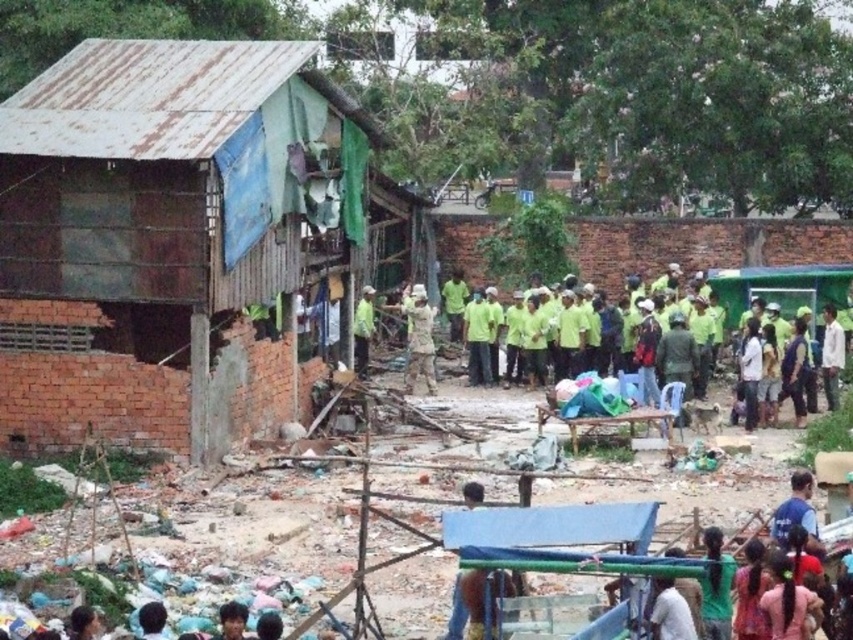
Question: Estimate the real-world distances between objects in this image. Which object is farther from the smooth brown hair at lower center?

Choices:
 (A) dark brown hair at lower left
 (B) green matte shirt at center
 (C) camouflage fabric uniform at center
 (D) rusty metal hut at left

Answer: (B)

Question: Where is camouflage fabric uniform at center located in relation to dark brown hair at lower left in the image?

Choices:
 (A) right
 (B) left

Answer: (A)

Question: Which of the following is the farthest from the observer?

Choices:
 (A) camouflage fabric uniform at center
 (B) green matte shirt at center
 (C) rusty metal hut at left
 (D) smooth brown hair at lower center

Answer: (B)

Question: Can you confirm if camouflage fabric uniform at center is thinner than green matte shirt at center?

Choices:
 (A) no
 (B) yes

Answer: (A)

Question: Which of these objects is positioned farthest from the green matte shirt at center?

Choices:
 (A) camouflage fabric uniform at center
 (B) smooth brown hair at lower center

Answer: (B)

Question: Does camouflage fabric uniform at center have a smaller size compared to green matte shirt at center?

Choices:
 (A) no
 (B) yes

Answer: (A)